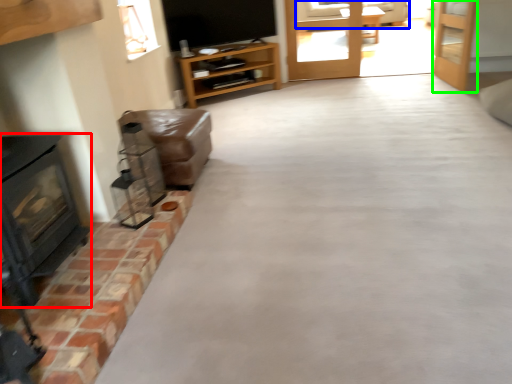
Question: Which is nearer to the wood burning stove (highlighted by a red box)? couch (highlighted by a blue box) or door (highlighted by a green box).

Choices:
 (A) couch
 (B) door

Answer: (B)